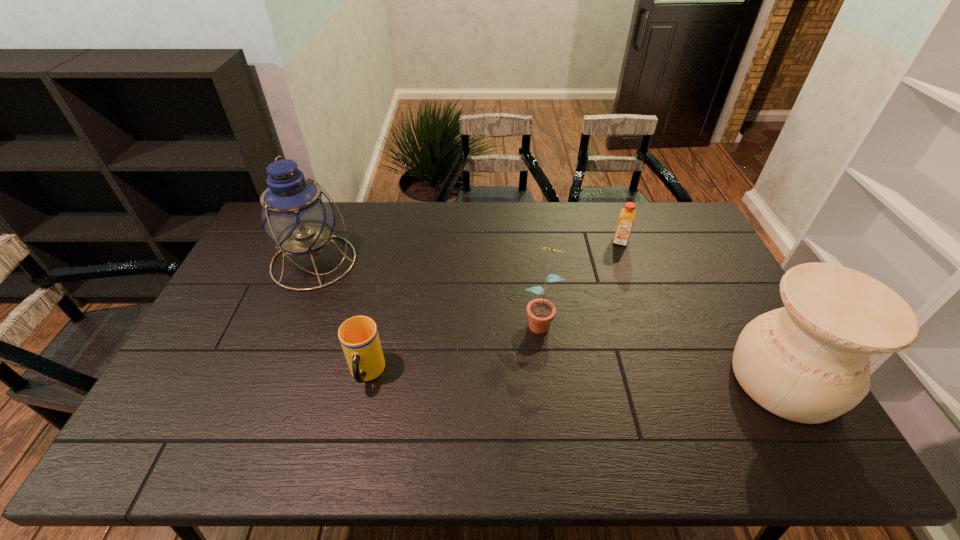
What are the coordinates of `object at the left edge` in the screenshot? It's located at (296, 214).

Locate an element on the screen. This screenshot has width=960, height=540. object located at the right edge is located at coordinates (809, 362).

The width and height of the screenshot is (960, 540). Find the location of `object that is at the far left corner`. object that is at the far left corner is located at coordinates (296, 214).

Image resolution: width=960 pixels, height=540 pixels. In order to click on object that is at the near right corner in this screenshot , I will do `click(809, 362)`.

Where is `vacant area at the far edge of the desktop`? The height and width of the screenshot is (540, 960). vacant area at the far edge of the desktop is located at coordinates (352, 227).

The image size is (960, 540). In order to click on blank space at the near edge of the desktop in this screenshot , I will do `click(546, 408)`.

In the image, there is a desktop. Where is `vacant space at the left edge`? vacant space at the left edge is located at coordinates (219, 332).

This screenshot has width=960, height=540. What are the coordinates of `vacant space at the right edge of the desktop` in the screenshot? It's located at (725, 294).

At what (x,y) coordinates should I click in order to perform the action: click on free location at the near left corner. Please return your answer as a coordinate pair (x, y). Looking at the image, I should click on (193, 408).

Identify the location of free spot at the far right corner of the desktop. (676, 212).